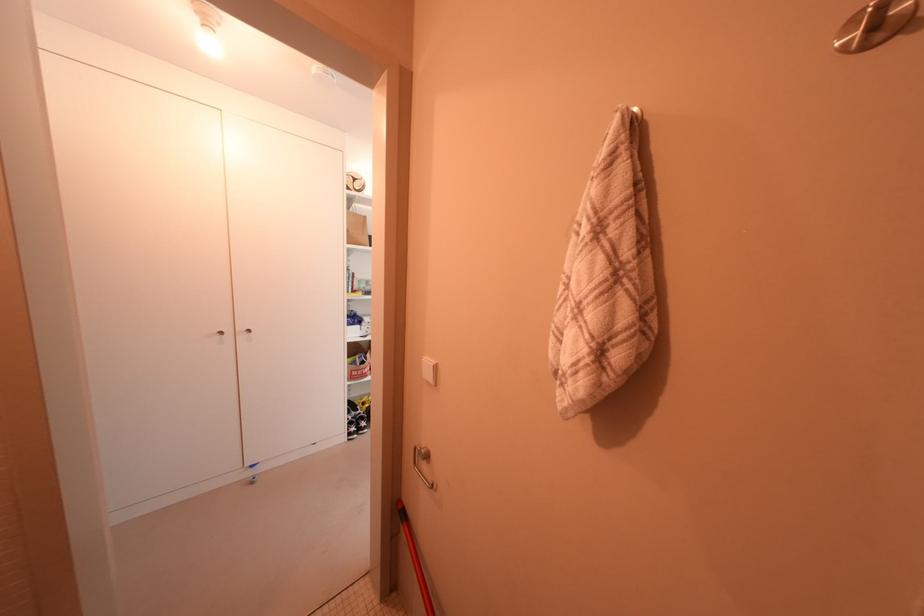
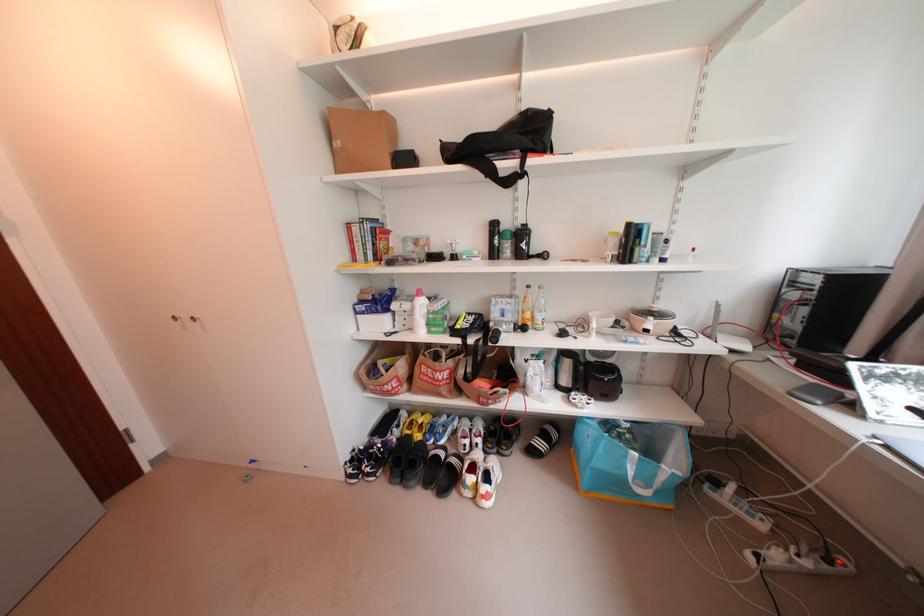
In the second image, find the point that corresponds to point 374,333 in the first image.

(412, 326)